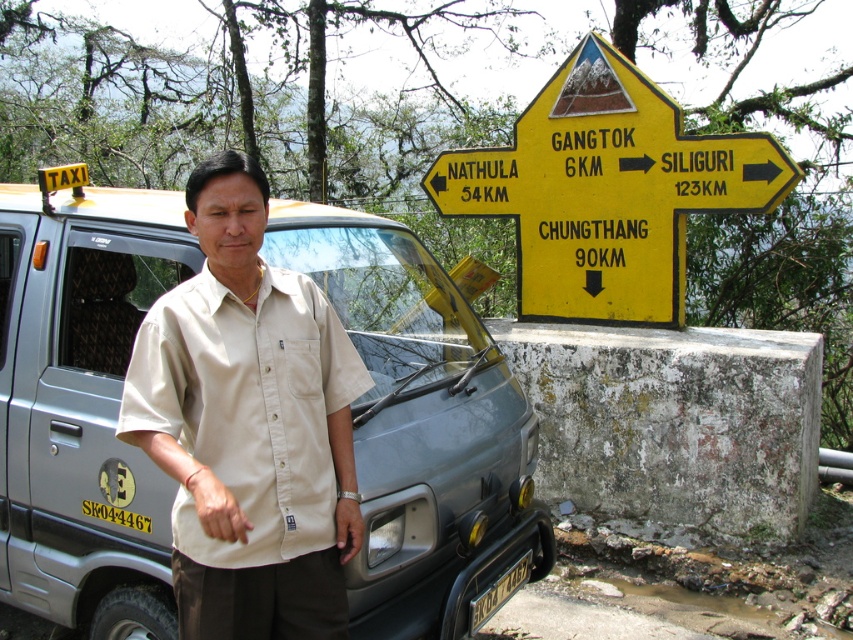
Question: Which object is positioned closest to the yellow plastic sign at upper right?

Choices:
 (A) yellow plastic license plate at lower center
 (B) silver metallic taxi at left
 (C) beige cotton shirt at center

Answer: (B)

Question: Is beige cotton shirt at center positioned at the back of yellow plastic sign at upper right?

Choices:
 (A) yes
 (B) no

Answer: (B)

Question: Is beige cotton shirt at center below yellow plastic license plate at lower center?

Choices:
 (A) yes
 (B) no

Answer: (B)

Question: Which object is positioned farthest from the silver metallic taxi at left?

Choices:
 (A) yellow plastic license plate at lower center
 (B) beige cotton shirt at center

Answer: (B)

Question: From the image, what is the correct spatial relationship of silver metallic taxi at left in relation to yellow plastic license plate at lower center?

Choices:
 (A) left
 (B) right

Answer: (A)

Question: Among these objects, which one is farthest from the camera?

Choices:
 (A) yellow plastic sign at upper right
 (B) silver metallic taxi at left

Answer: (A)